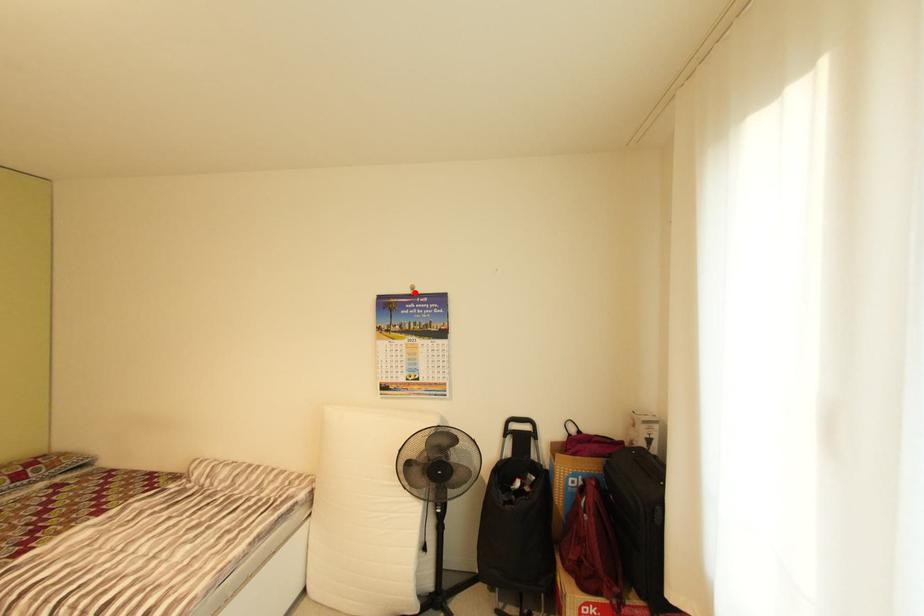
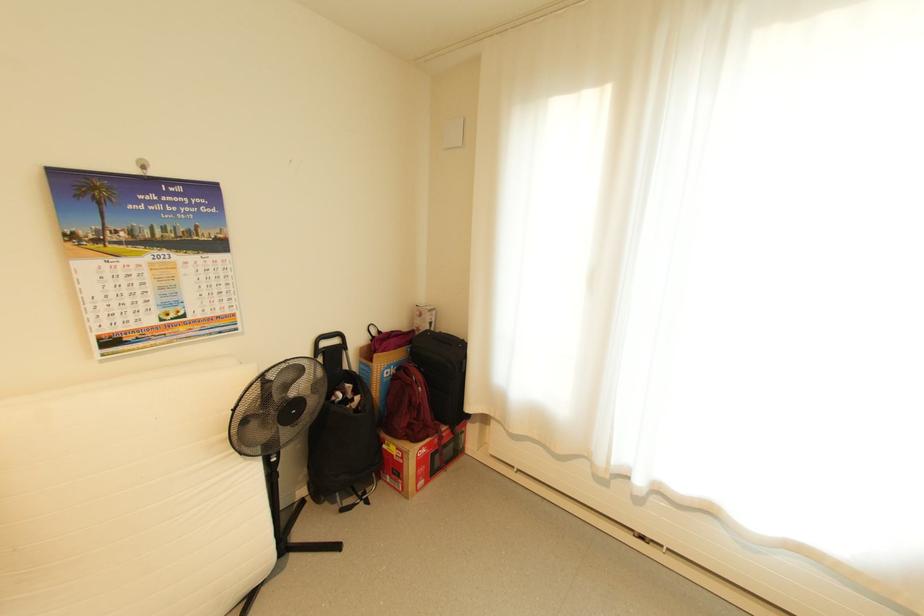
The point at the highlighted location is marked in the first image. Where is the corresponding point in the second image?

(140, 172)